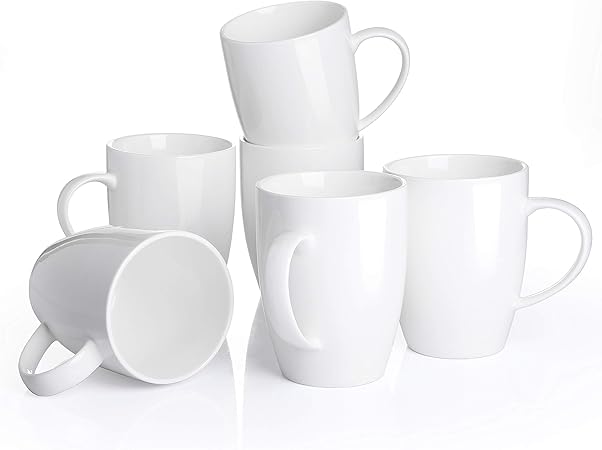
Where is `mugs`? Image resolution: width=602 pixels, height=450 pixels. mugs is located at coordinates (79, 266), (324, 270), (483, 252), (190, 196), (293, 170), (285, 98).